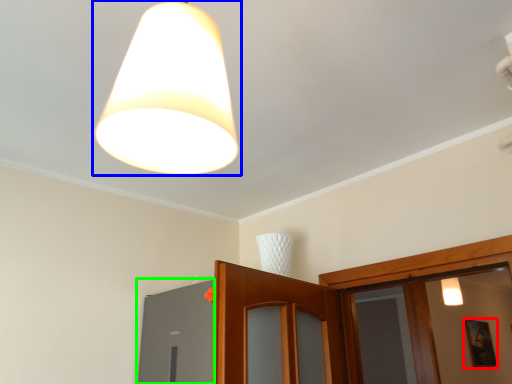
Question: Which object is positioned closest to picture frame (highlighted by a red box)? Select from lamp (highlighted by a blue box) and window (highlighted by a green box).

Choices:
 (A) lamp
 (B) window

Answer: (B)